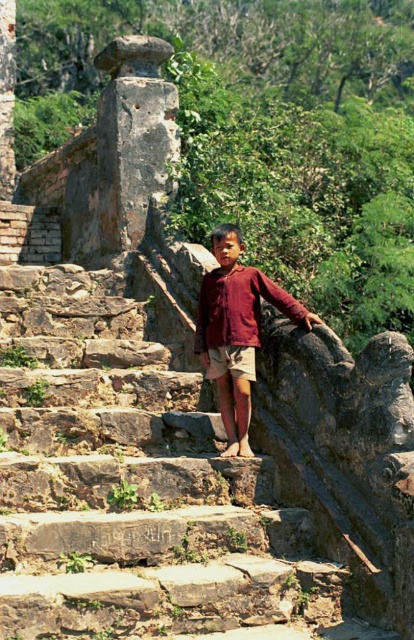
Between point (153, 564) and point (245, 317), which one is positioned behind?

The point (245, 317) is behind.

Does brown stone stairs at center appear on the right side of matte red shirt at center?

No, brown stone stairs at center is not to the right of matte red shirt at center.

Find the location of a particular element. The image size is (414, 640). brown stone stairs at center is located at coordinates (129, 481).

Find the location of a particular element. The image size is (414, 640). brown stone stairs at center is located at coordinates (129, 481).

Who is higher up, brown stone stairs at center or khaki cotton shorts at center?

khaki cotton shorts at center is above.

Who is more forward, [64,492] or [219,371]?

Point [64,492]

Locate an element on the screen. The height and width of the screenshot is (640, 414). brown stone stairs at center is located at coordinates (129, 481).

Does matte red shirt at center have a smaller size compared to khaki cotton shorts at center?

No.

Is matte red shirt at center bigger than khaki cotton shorts at center?

Indeed, matte red shirt at center has a larger size compared to khaki cotton shorts at center.

Is point (252, 326) closer to viewer compared to point (247, 352)?

No, it is not.

Identify the location of matte red shirt at center. (236, 330).